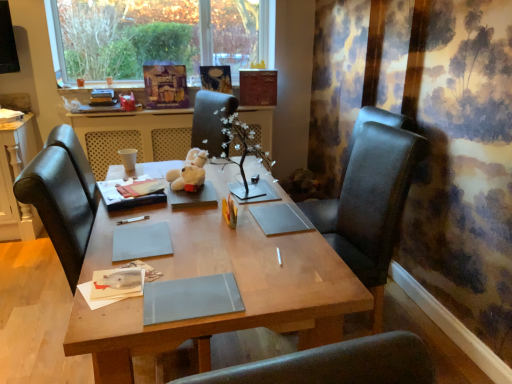
Locate an element on the screen. The height and width of the screenshot is (384, 512). free space between matte gray notebook at center, placed as the first notebook when sorted from front to back, and white plush bear at center is located at coordinates (198, 238).